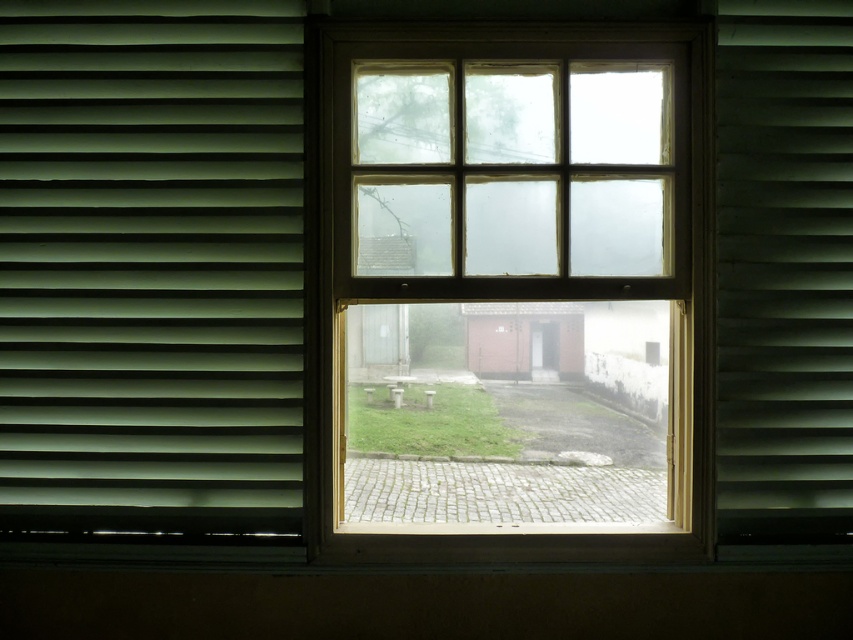
Where is `clear glass window at center`? The height and width of the screenshot is (640, 853). clear glass window at center is located at coordinates (515, 275).

Can you confirm if clear glass window at center is positioned to the left of green matte shutter at right?

Correct, you'll find clear glass window at center to the left of green matte shutter at right.

Is point (368, 433) positioned before point (720, 214)?

That is False.

I want to click on clear glass window at center, so click(x=515, y=275).

Does point (518, 198) lie in front of point (102, 435)?

That is False.

Can you confirm if clear glass window at center is positioned below green matte blinds at left?

Indeed, clear glass window at center is positioned under green matte blinds at left.

I want to click on clear glass window at center, so click(515, 275).

Which is more to the left, green matte blinds at left or green matte shutter at right?

Positioned to the left is green matte blinds at left.

Does green matte blinds at left have a smaller size compared to green matte shutter at right?

Incorrect, green matte blinds at left is not smaller in size than green matte shutter at right.

Is point (122, 461) closer to viewer compared to point (733, 61)?

Yes, it is.

In order to click on green matte blinds at left in this screenshot , I will do `click(149, 269)`.